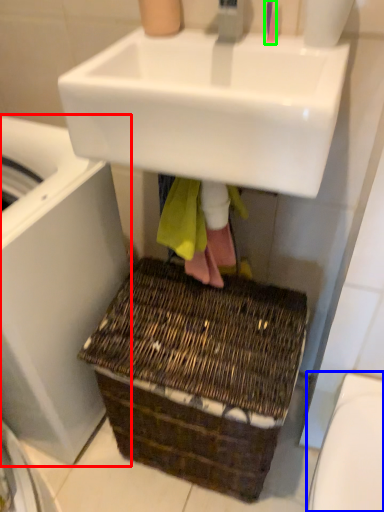
Question: Which object is positioned closest to washing machine (highlighted by a red box)? Select from toilet bowl (highlighted by a blue box) and toothbrush (highlighted by a green box).

Choices:
 (A) toilet bowl
 (B) toothbrush

Answer: (A)